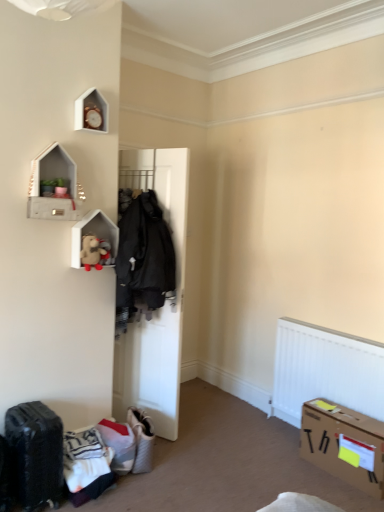
This screenshot has height=512, width=384. In order to click on free point to the left of cardboard box at lower right in this screenshot , I will do `click(286, 467)`.